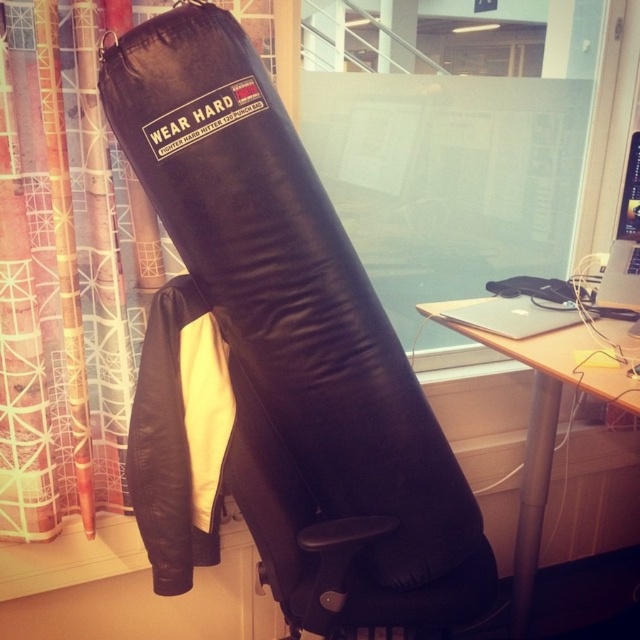
Based on the photo, you are standing in a boxing gym and see the black leather boxing glove at center. If you want to place it exactly at the center of the room, is it currently positioned correctly?

The black leather boxing glove at center is already positioned at the center of the room since its coordinates are exactly at point (280, 356), which corresponds to the center point in the image coordinate system.

You are standing in a room with a large black punching bag labeled WEAR HARD and a textured fabric curtain at left. If you want to move closer to the punching bag, should you walk towards the left or the right side of the room?

The textured fabric curtain at left is positioned at the left side of the room, so to move closer to the punching bag, you should walk towards the right side of the room.